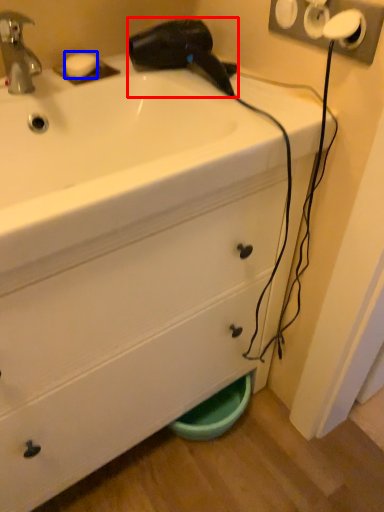
Question: Which point is closer to the camera, hair drier (highlighted by a red box) or soap (highlighted by a blue box)?

Choices:
 (A) hair drier
 (B) soap

Answer: (A)